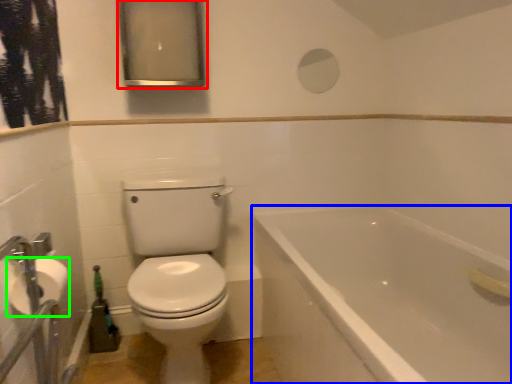
Question: Which object is positioned farthest from medicine cabinet (highlighted by a red box)? Select from bathtub (highlighted by a blue box) and toilet paper (highlighted by a green box).

Choices:
 (A) bathtub
 (B) toilet paper

Answer: (B)